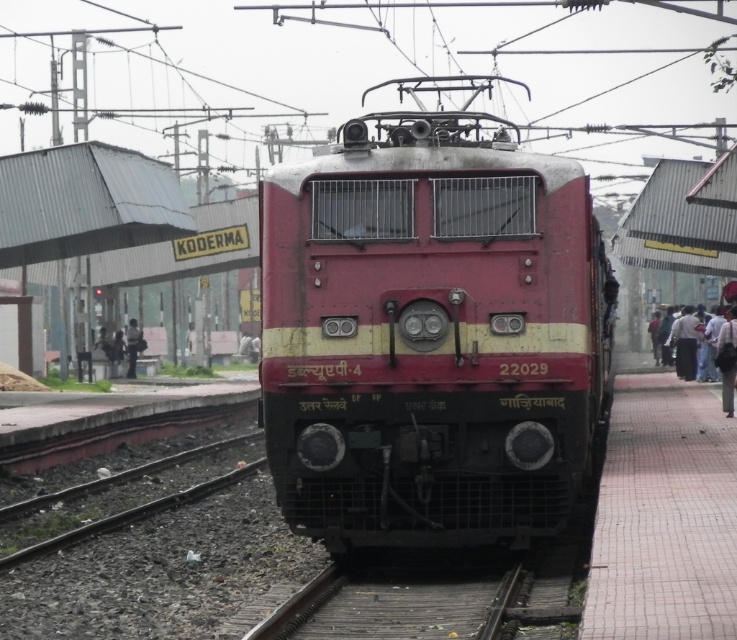
You are a photographer standing on the platform and want to take a photo of the red and yellow electric locomotive. You notice two people wearing dark blue jeans at right and dark gray fabric jacket at left. Which person is closer to the locomotive?

The dark blue jeans at right is in front of the dark gray fabric jacket at left, so the person wearing dark blue jeans at right is closer to the locomotive.

You are a photographer standing on the platform and want to take a photo of the dark blue jeans at right without the dark gray fabric people at right blocking it. Is this possible?

The dark blue jeans at right is behind dark gray fabric people at right, so it is blocked by them. Therefore, you cannot take a photo of the dark blue jeans at right without the dark gray fabric people at right blocking it.